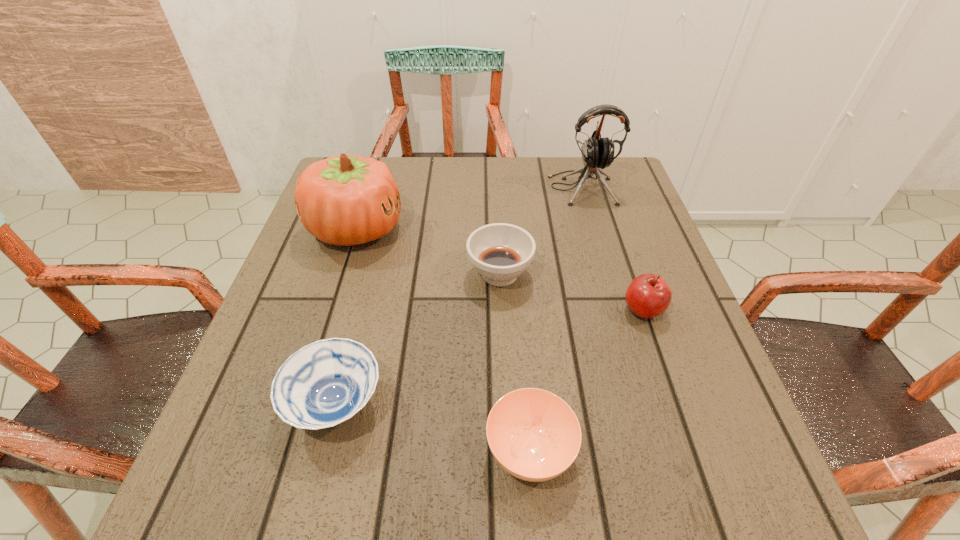
At what (x,y) coordinates should I click in order to perform the action: click on earphone present at the far edge. Please return your answer as a coordinate pair (x, y). The width and height of the screenshot is (960, 540). Looking at the image, I should click on (597, 152).

The height and width of the screenshot is (540, 960). Find the location of `pumpkin positioned at the far edge`. pumpkin positioned at the far edge is located at coordinates (345, 200).

Where is `object located in the near edge section of the desktop`? The image size is (960, 540). object located in the near edge section of the desktop is located at coordinates (534, 435).

Where is `pumpkin situated at the left edge`? pumpkin situated at the left edge is located at coordinates (345, 200).

You are a GUI agent. You are given a task and a screenshot of the screen. Output one action in this format:
    pyautogui.click(x=<x>, y=<y>)
    Task: Click on the soup bowl at the left edge
    
    Given the screenshot: What is the action you would take?
    pyautogui.click(x=325, y=383)

Locate an element on the screen. earphone positioned at the right edge is located at coordinates click(597, 152).

The image size is (960, 540). What are the coordinates of `apple at the right edge` in the screenshot? It's located at (648, 295).

You are a GUI agent. You are given a task and a screenshot of the screen. Output one action in this format:
    pyautogui.click(x=<x>, y=<y>)
    Task: Click on the object that is at the far left corner
    
    Given the screenshot: What is the action you would take?
    pyautogui.click(x=345, y=200)

I want to click on object present at the far right corner, so click(597, 152).

I want to click on blank space at the far edge of the desktop, so click(x=523, y=158).